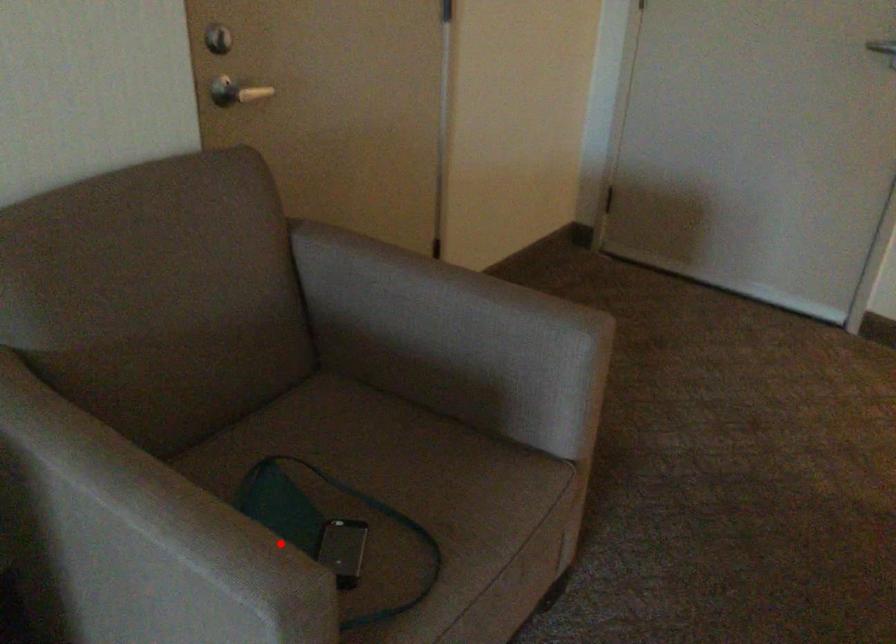
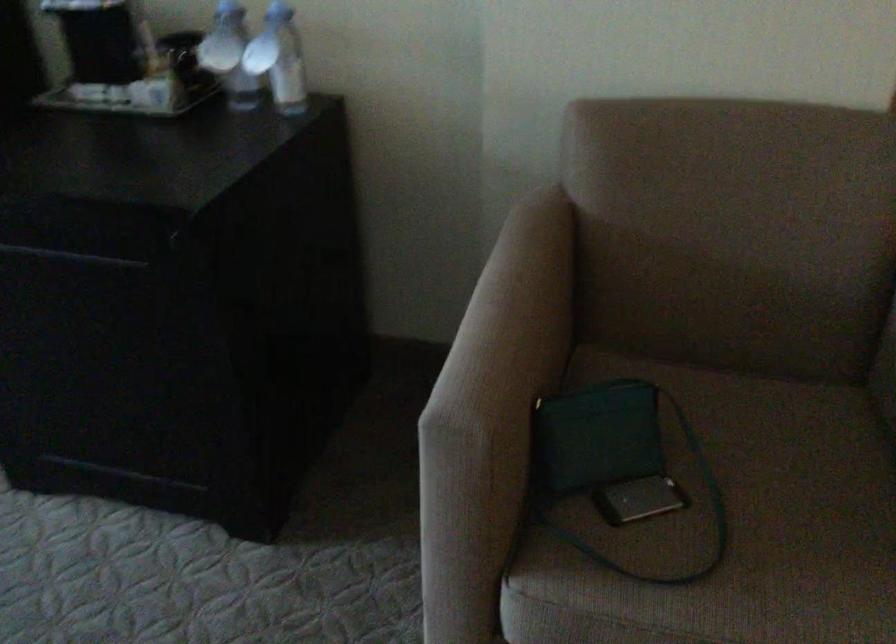
Where in the second image is the point corresponding to the highlighted location from the first image?

(495, 390)